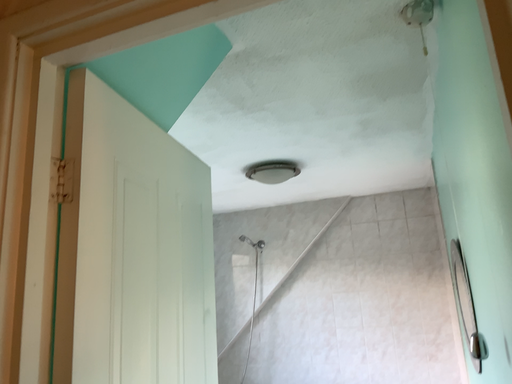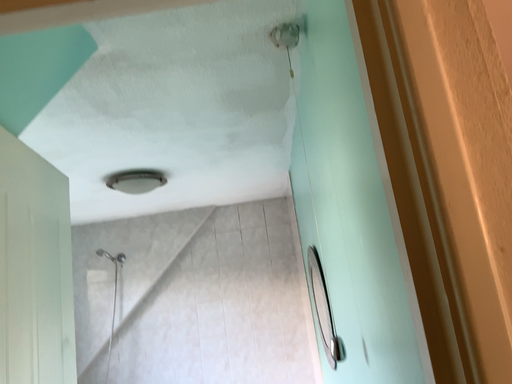
Question: Which way did the camera rotate in the video?

Choices:
 (A) rotated right
 (B) rotated left

Answer: (A)